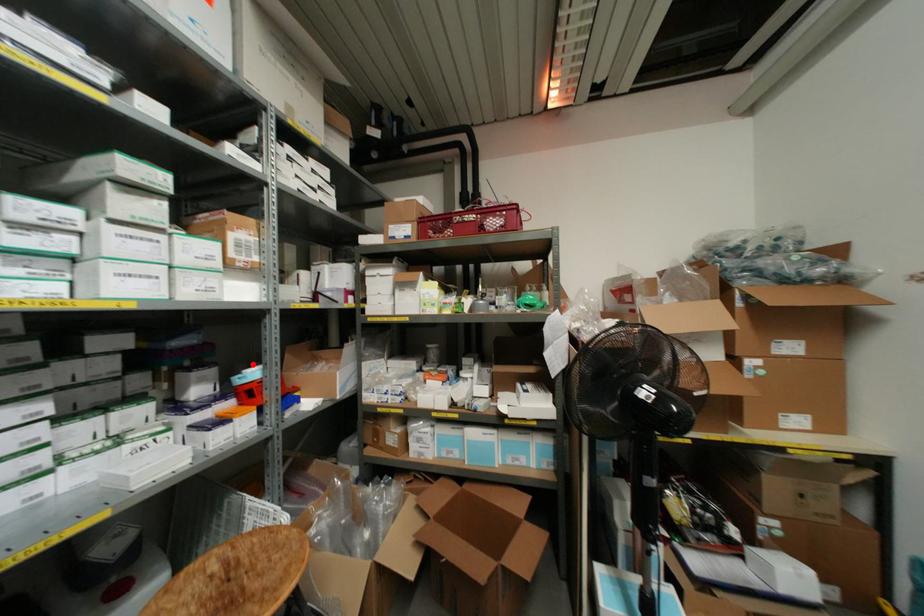
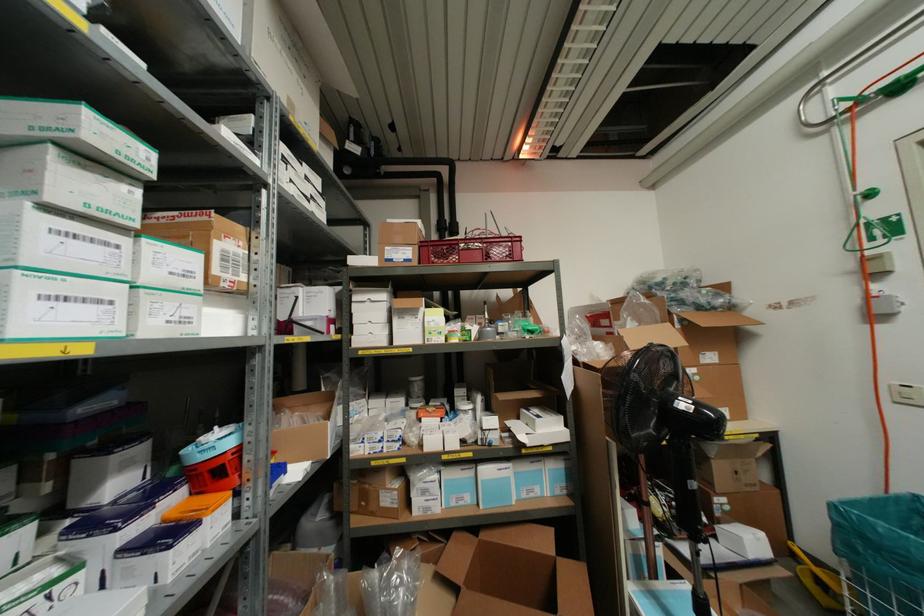
The point at the highlighted location is marked in the first image. Where is the corresponding point in the second image?

(214, 427)